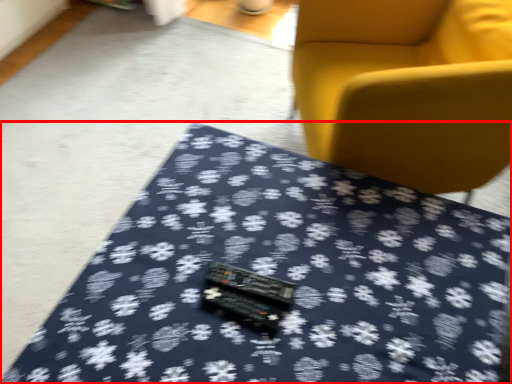
Question: From the image's perspective, what is the correct spatial relationship of table (annotated by the red box) in relation to chair?

Choices:
 (A) below
 (B) above

Answer: (A)